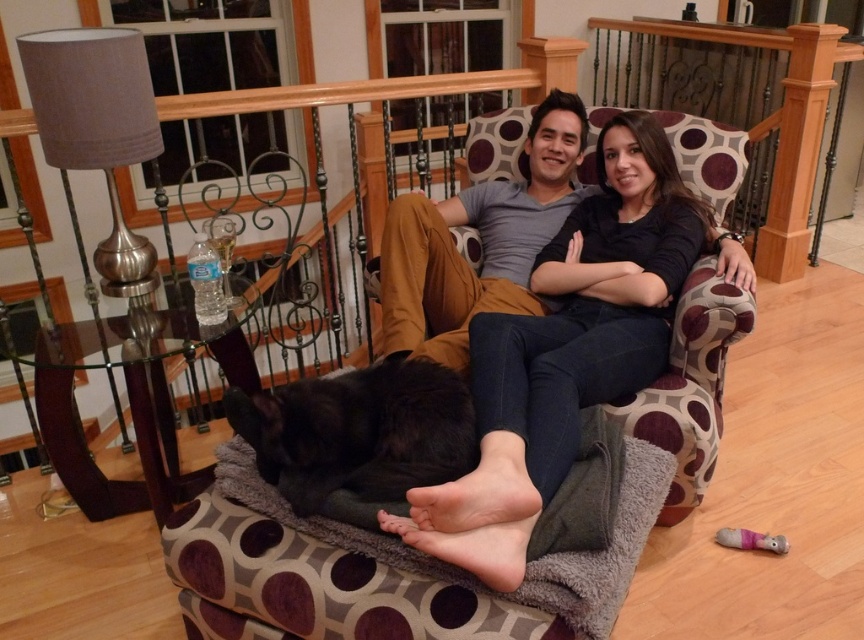
Question: Which object is farther from the camera taking this photo?

Choices:
 (A) matte gray shirt at center
 (B) soft gray fabric dog bed at center
 (C) dark blue jeans at center
 (D) black fluffy dog at center

Answer: (A)

Question: Observing the image, what is the correct spatial positioning of dark blue jeans at center in reference to black fluffy dog at center?

Choices:
 (A) above
 (B) below

Answer: (A)

Question: Does dark blue jeans at center appear under matte gray shirt at center?

Choices:
 (A) yes
 (B) no

Answer: (A)

Question: Among these objects, which one is farthest from the camera?

Choices:
 (A) dark blue jeans at center
 (B) black fluffy dog at center
 (C) soft gray fabric dog bed at center

Answer: (B)

Question: Which object appears closest to the camera in this image?

Choices:
 (A) dark blue jeans at center
 (B) matte gray shirt at center

Answer: (A)

Question: Is dark blue jeans at center thinner than black fluffy dog at center?

Choices:
 (A) no
 (B) yes

Answer: (A)